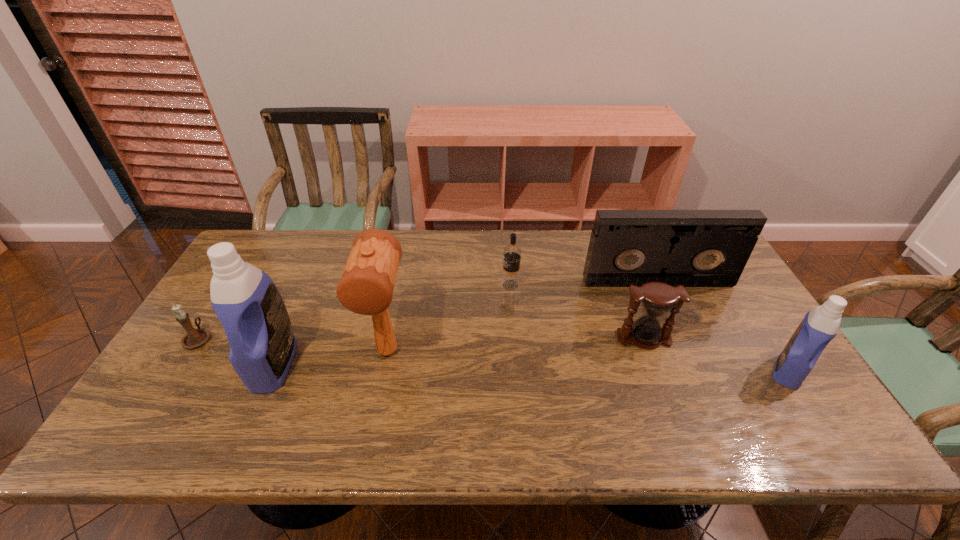
Identify the location of vacant point located between the candle holder and the shorter detergent. [493, 355].

I want to click on vacant region between the shorter detergent and the videotape, so click(723, 327).

Locate an element on the screen. The image size is (960, 540). free space between the candle holder and the right detergent is located at coordinates (493, 355).

Where is `free space between the videotape and the mallet`? The image size is (960, 540). free space between the videotape and the mallet is located at coordinates (522, 317).

Locate an element on the screen. The height and width of the screenshot is (540, 960). free space that is in between the videotape and the shorter detergent is located at coordinates (723, 327).

Where is `free space between the candle holder and the right detergent`? The image size is (960, 540). free space between the candle holder and the right detergent is located at coordinates (493, 355).

Point out which object is positioned as the second nearest to the videotape. Please provide its 2D coordinates. Your answer should be formatted as a tuple, i.e. [(x, y)], where the tuple contains the x and y coordinates of a point satisfying the conditions above.

[(510, 280)]

Where is `object identified as the fifth closest to the shorter detergent`? object identified as the fifth closest to the shorter detergent is located at coordinates (x=247, y=302).

Locate an element on the screen. The image size is (960, 540). free space that satisfies the following two spatial constraints: 1. on the strike surface of the third object from left to right; 2. on the left side of the right detergent is located at coordinates (384, 371).

Where is `free spot that satisfies the following two spatial constraints: 1. on the label of the vodka; 2. on the back side of the hourglass`? free spot that satisfies the following two spatial constraints: 1. on the label of the vodka; 2. on the back side of the hourglass is located at coordinates click(x=515, y=338).